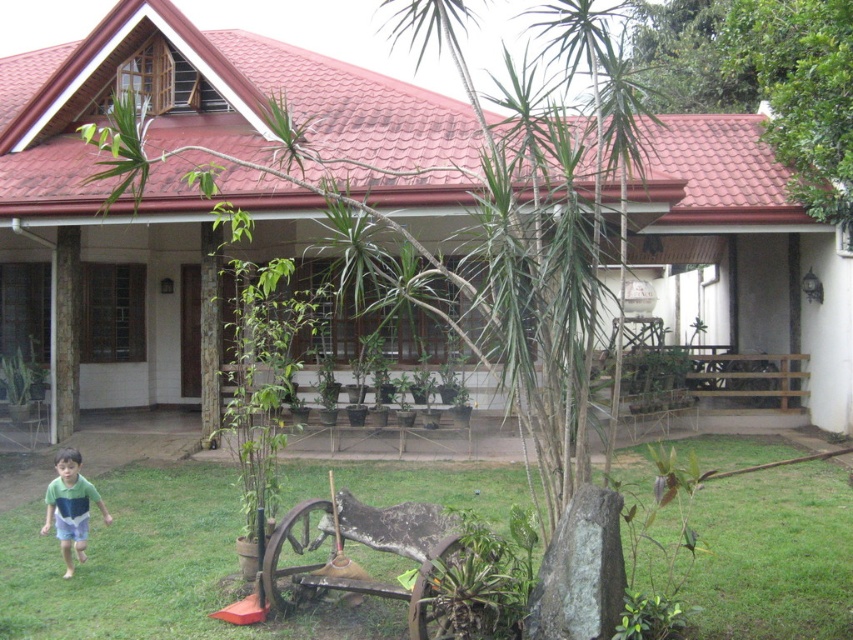
Between green grass at lower left and green cotton shirt at lower left, which one is positioned lower?

green grass at lower left

Can you confirm if green grass at lower left is positioned below green cotton shirt at lower left?

Yes.

Who is more forward, (x=804, y=474) or (x=55, y=468)?

Point (x=55, y=468)

Find the location of a particular element. This screenshot has width=853, height=640. green grass at lower left is located at coordinates (151, 566).